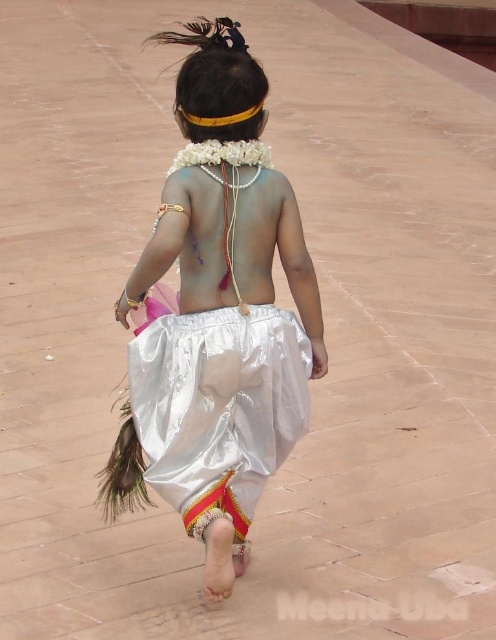
Based on the scene description, which skirt is positioned higher on the child, the shiny silver skirt at center or the shiny white skirt at center?

The shiny silver skirt at center is positioned higher because it is located above the shiny white skirt at center.

You are a photographer trying to capture the child in the image. You want to ensure both the shiny silver skirt at center and the shiny white skirt at center are clearly visible in your shot. Given that your camera has a minimum focus distance of 6 inches, will you be able to focus on both skirts simultaneously?

The shiny silver skirt at center and shiny white skirt at center are 6.32 inches apart from each other. Since the distance between them is greater than the camera minimum focus distance of 6 inches, the camera can focus on both skirts simultaneously.